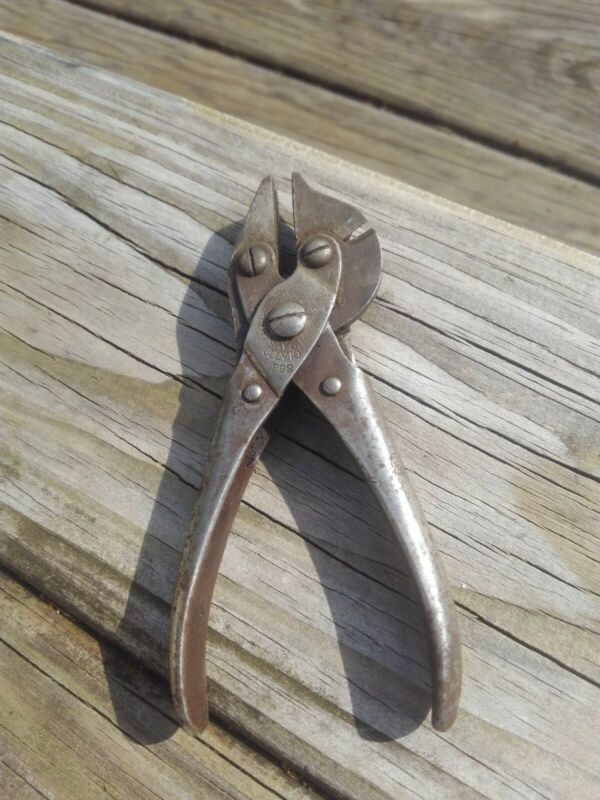
This screenshot has width=600, height=800. Find the location of `wooden plank`. wooden plank is located at coordinates (448, 285).